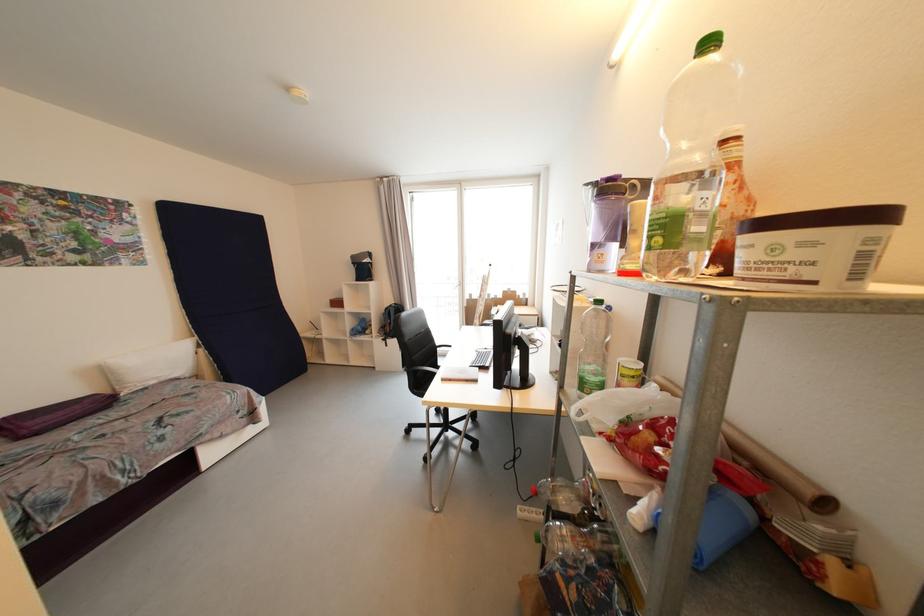
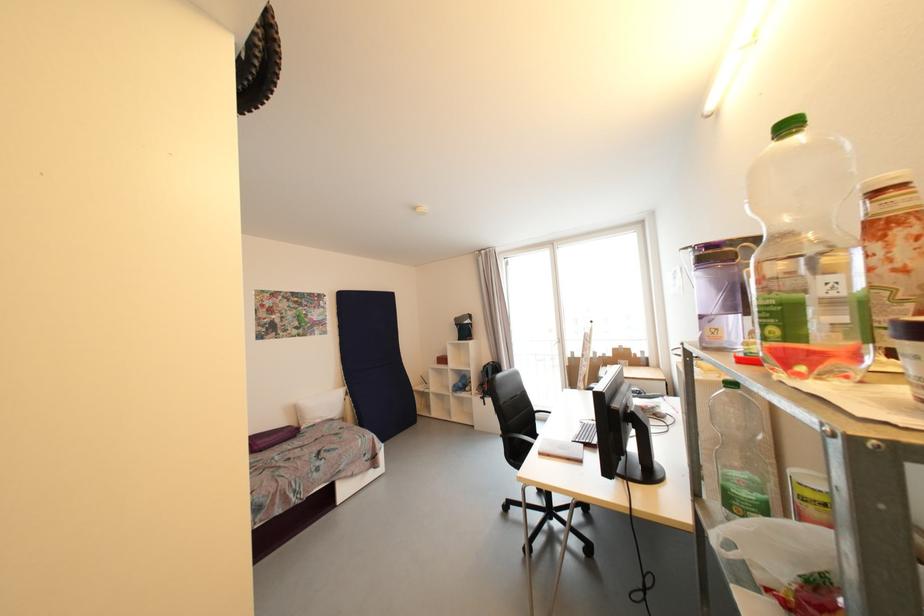
Locate, in the second image, the point that corresponds to (392,310) in the first image.

(490, 368)